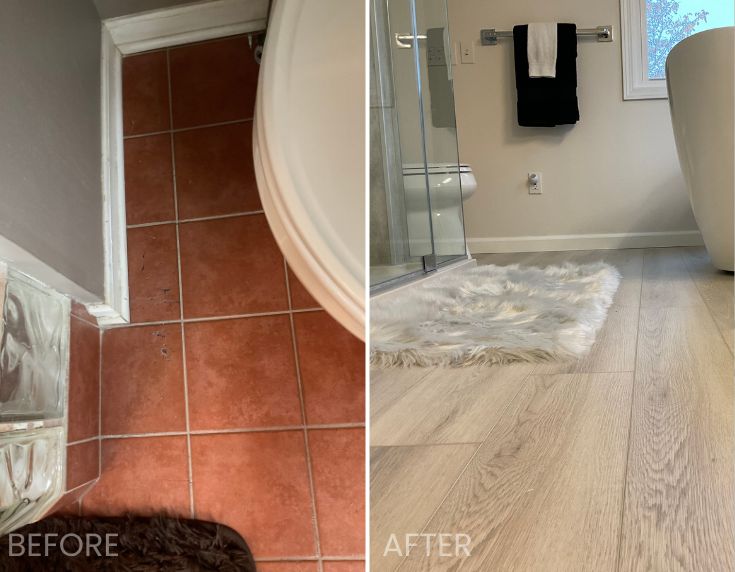
Identify the location of shower door. This screenshot has height=572, width=735. (389, 214).